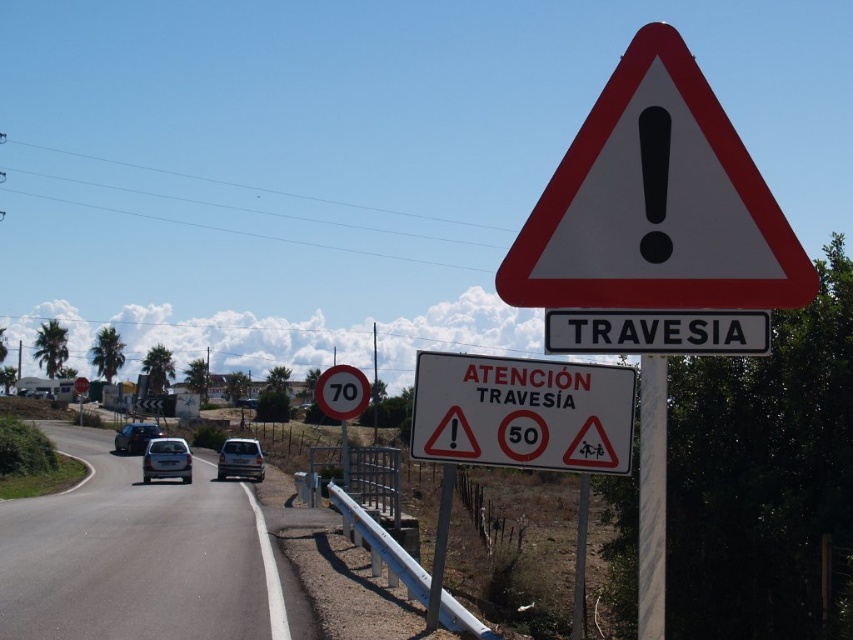
You are a delivery driver approaching the asphalt road at center. The GPS says to turn left at the next intersection, but you see the triangular warning sign with a red border and a black exclamation mark. Where should you look for the intersection?

The asphalt road at center is located at point [142,557], so you should look ahead towards the center where the asphalt road is positioned to find the intersection.

You are driving a car and see the white plastic sign at upper center and the satin silver car at center ahead. Which object is shorter in height?

The white plastic sign at upper center is shorter than the satin silver car at center.

You are a city planner analyzing traffic signs. You observe a white textured pole at center and a metallic pole at center in the scene. Which pole has a greater width?

The metallic pole at center has a greater width than the white textured pole at center.